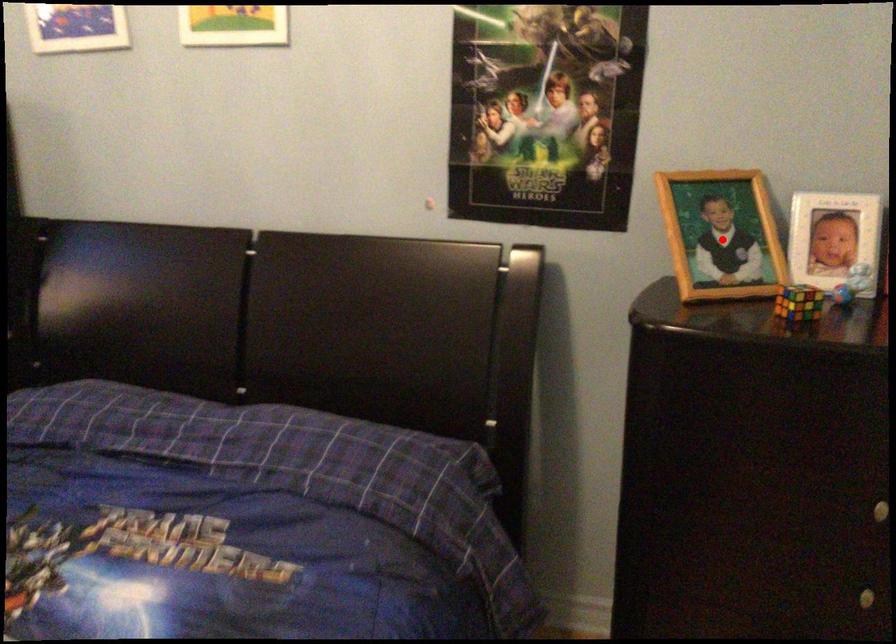
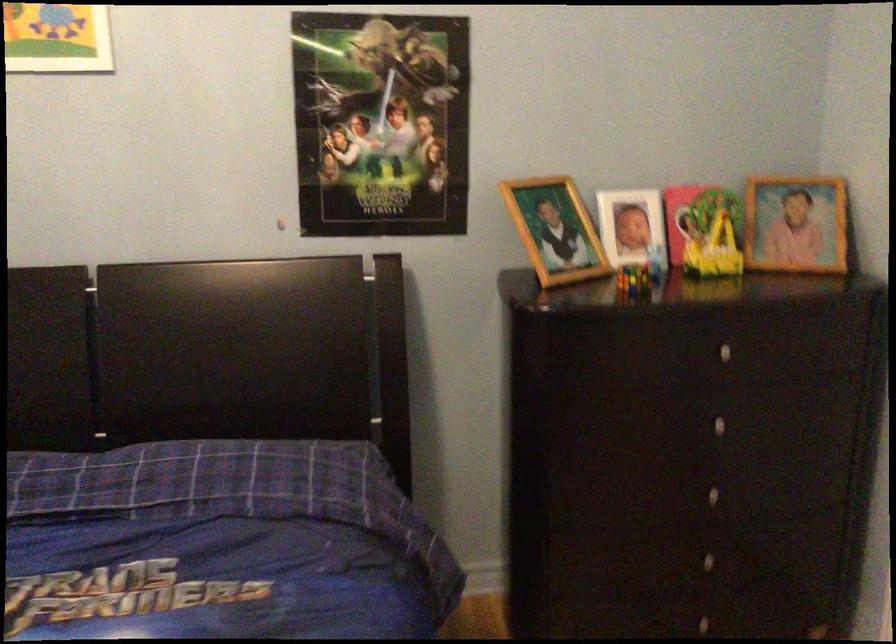
The point at the highlighted location is marked in the first image. Where is the corresponding point in the second image?

(555, 230)